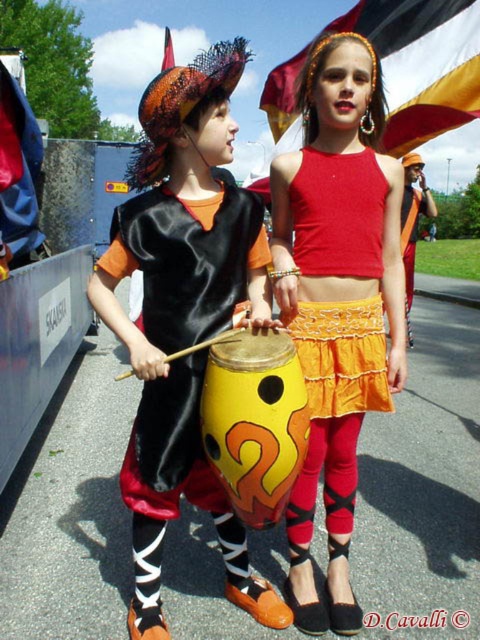
You are a photographer setting up for a photo shoot. You want to ensure that both the black satin drum at center and the orange lace skirt at center are visible in the frame. Based on their positions, which object should you focus on first to capture both in the shot?

The black satin drum at center is located below the orange lace skirt at center, so focusing on the orange lace skirt at center first will ensure both objects are in the frame.

You are taking a photo of two children in vibrant costumes. You notice two points in the image at coordinates point (171, 440) and point (351, 369). Which point is closer to the camera?

Point (171, 440) is closer to the camera than point (351, 369).